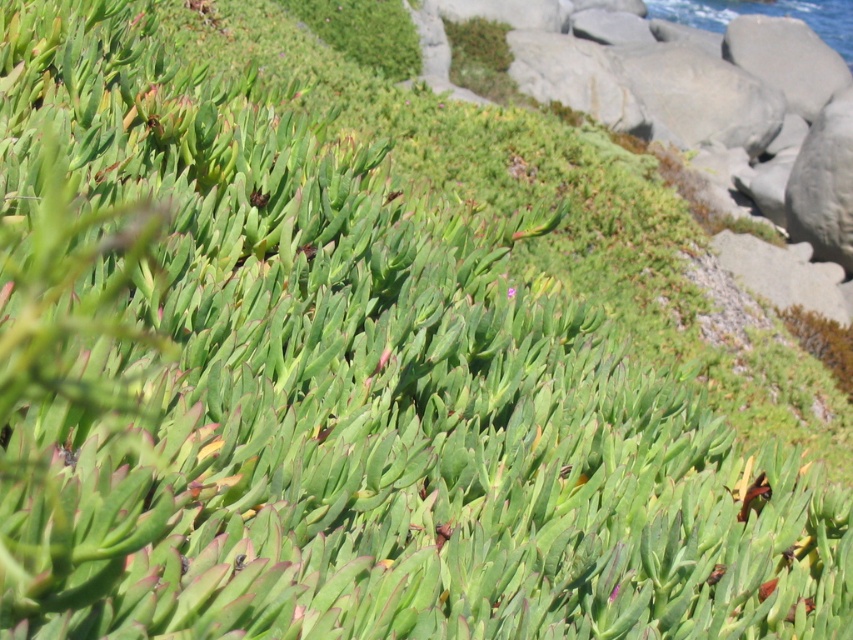
Question: Which point is farther to the camera?

Choices:
 (A) (514, 292)
 (B) (714, 3)

Answer: (B)

Question: From the image, what is the correct spatial relationship of blue water at upper right in relation to green succulent at center?

Choices:
 (A) above
 (B) below

Answer: (A)

Question: Can you confirm if blue water at upper right is positioned below green succulent at center?

Choices:
 (A) yes
 (B) no

Answer: (B)

Question: Is blue water at upper right in front of green succulent at center?

Choices:
 (A) no
 (B) yes

Answer: (A)